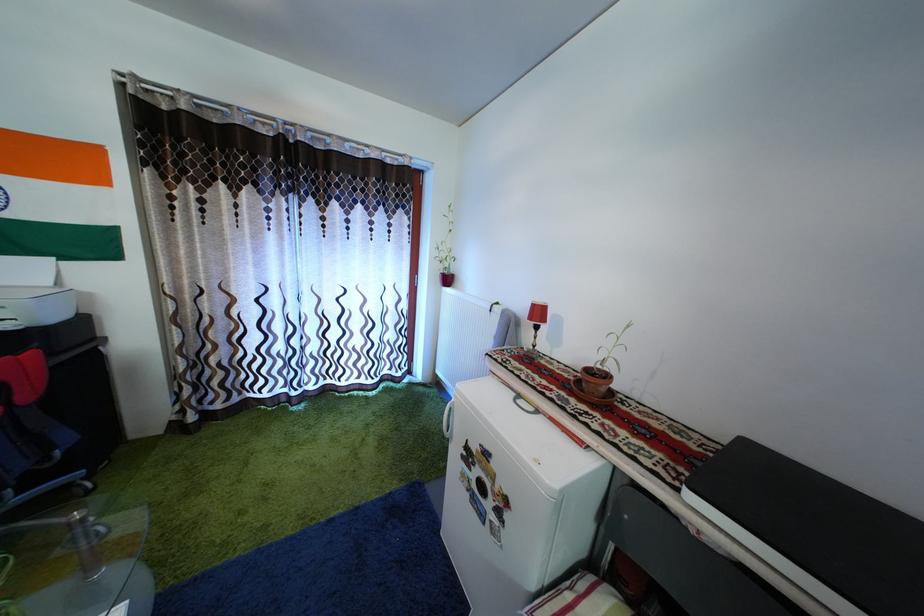
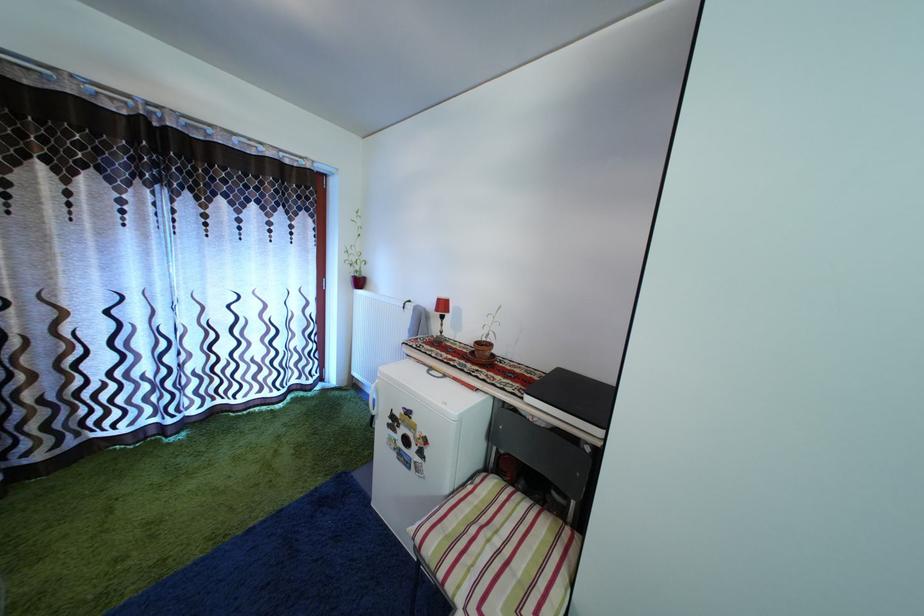
Question: I am providing you with two images of the same scene from different viewpoints. Which of the following objects are not visible in image2?

Choices:
 (A) terracotta plant pot
 (B) white fridge handle
 (C) striped chair sitting surface
 (D) none of these

Answer: (D)